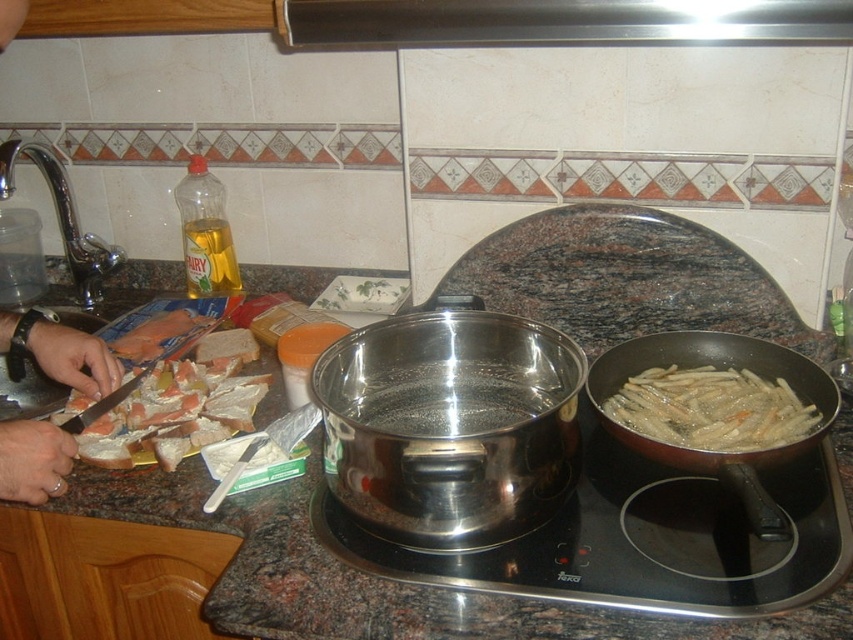
Which is more to the left, granite countertop at center or golden crispy fries at right?

granite countertop at center is more to the left.

Between point (428, 600) and point (630, 413), which one is positioned behind?

The point (630, 413) is behind.

Where is `granite countertop at center`? granite countertop at center is located at coordinates (381, 580).

Is stainless steel pan at center to the left of metallic stainless steel exhaust hood at upper center from the viewer's perspective?

No, stainless steel pan at center is not to the left of metallic stainless steel exhaust hood at upper center.

Can you confirm if stainless steel pan at center is positioned to the right of metallic stainless steel exhaust hood at upper center?

Correct, you'll find stainless steel pan at center to the right of metallic stainless steel exhaust hood at upper center.

Between point (680, 520) and point (444, 33), which one is positioned in front?

Positioned in front is point (680, 520).

This screenshot has height=640, width=853. What are the coordinates of `stainless steel pan at center` in the screenshot? It's located at (637, 536).

Does smooth white bread at left have a larger size compared to white bread at left?

Yes.

Does point (16, 433) come behind point (242, 426)?

No, it is not.

This screenshot has height=640, width=853. What are the coordinates of `smooth white bread at left` in the screenshot? It's located at (62, 353).